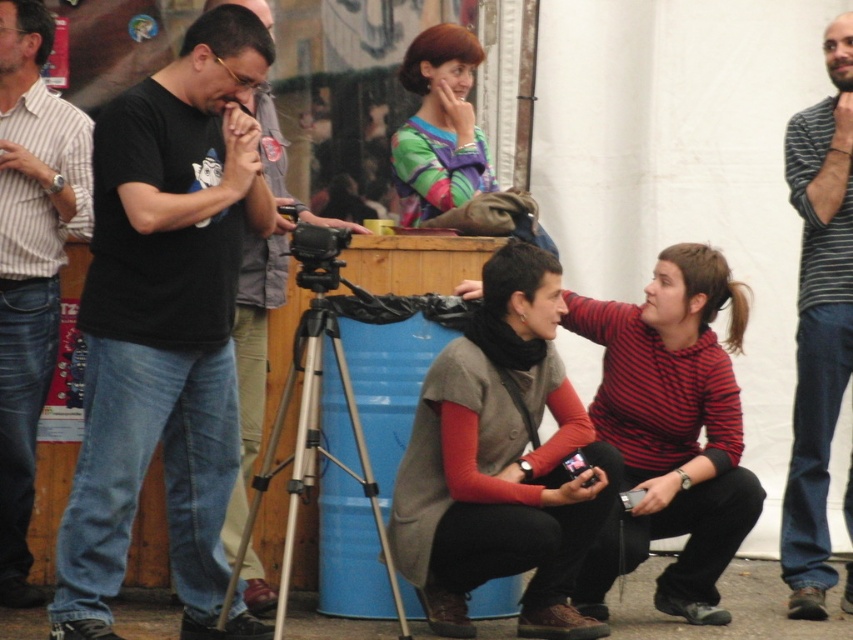
Question: Among these objects, which one is nearest to the camera?

Choices:
 (A) black plastic video camera at center
 (B) multicolored fabric shirt at center
 (C) knit sweater at center
 (D) black matte camera at left

Answer: (C)

Question: Can you confirm if striped cotton shirt at center is positioned below silver metallic tripod at center?

Choices:
 (A) yes
 (B) no

Answer: (B)

Question: Does striped cotton shirt at left appear on the left side of silver metallic tripod at center?

Choices:
 (A) yes
 (B) no

Answer: (A)

Question: Which of the following is the closest to the observer?

Choices:
 (A) (827, 458)
 (B) (254, 396)
 (C) (103, 280)
 (D) (721, 404)

Answer: (C)

Question: Does striped cotton shirt at right have a smaller size compared to multicolored fabric shirt at center?

Choices:
 (A) yes
 (B) no

Answer: (B)

Question: Estimate the real-world distances between objects in this image. Which object is closer to the silver metallic tripod at center?

Choices:
 (A) multicolored fabric shirt at center
 (B) striped cotton shirt at right
 (C) black plastic video camera at center

Answer: (C)